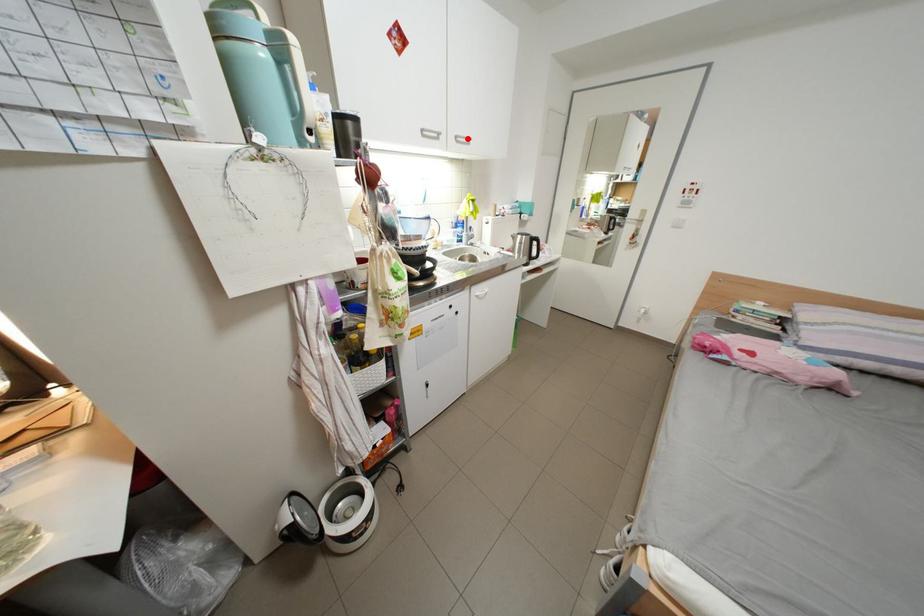
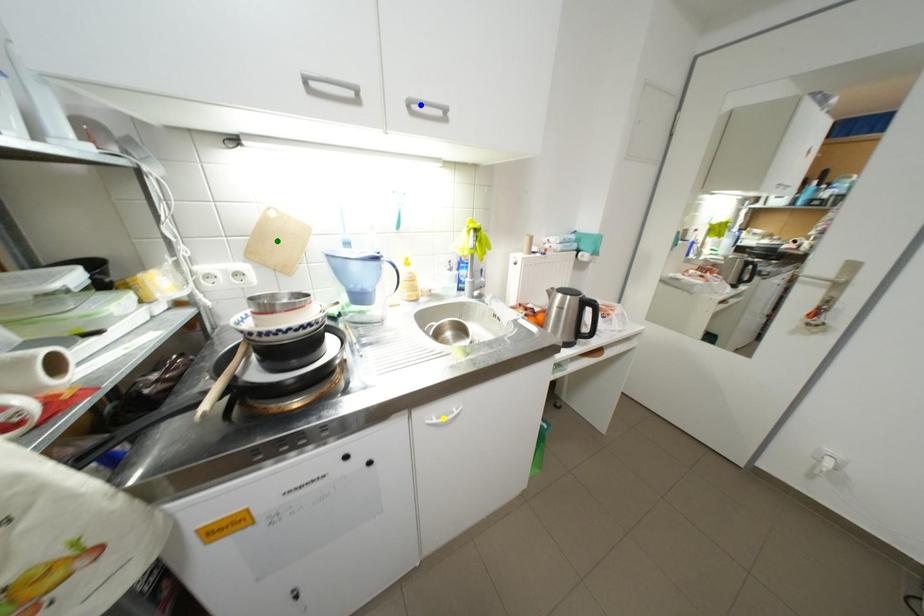
Question: I am providing you with two images of the same scene from different viewpoints. A red point is marked on the first image. You are given multiple points on the second image. In image 2, which mark is for the same physical point as the one in image 1?

Choices:
 (A) blue point
 (B) yellow point
 (C) green point

Answer: (A)